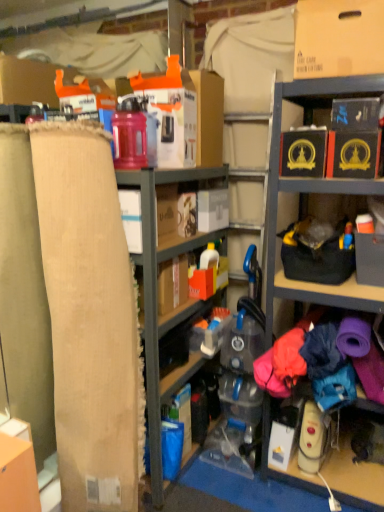
Question: Looking at the image, does black cardboard box at upper right, which is the 2th storage box from left to right, seem bigger or smaller compared to black cardboard box at upper right, acting as the 1th storage box starting from the right?

Choices:
 (A) small
 (B) big

Answer: (B)

Question: Is black cardboard box at upper right, positioned as the 2th storage box in right-to-left order, inside the boundaries of black cardboard box at upper right, the 3th storage box in the left-to-right sequence, or outside?

Choices:
 (A) outside
 (B) inside

Answer: (A)

Question: Estimate the real-world distances between objects in this image. Which object is closer to the black cardboard box at upper right, which is the 2th storage box from left to right?

Choices:
 (A) black cardboard box at upper right, acting as the 1th storage box starting from the right
 (B) burlap cardboard at left
 (C) beige fabric at left
 (D) white cardboard toaster at center, the first storage box viewed from the left
 (E) matte cardboard box at upper right

Answer: (A)

Question: Considering the real-world distances, which object is farthest from the white cardboard toaster at center, placed as the third storage box when sorted from right to left?

Choices:
 (A) black cardboard box at upper right, acting as the 1th storage box starting from the right
 (B) beige fabric at left
 (C) burlap cardboard at left
 (D) matte cardboard box at upper right
 (E) black cardboard box at upper right, positioned as the 2th storage box in right-to-left order

Answer: (D)